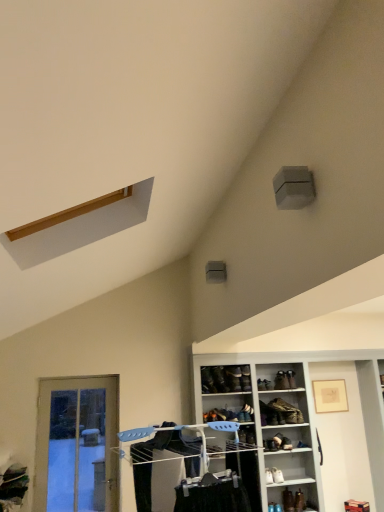
Question: Is leather shoe at lower right, which is counted as the eighth shoe, starting from the top, taller than leather shoe at center, the fifth shoe in the top-to-bottom sequence?

Choices:
 (A) no
 (B) yes

Answer: (B)

Question: From the image's perspective, is leather shoe at lower right, marked as the 2th shoe in a bottom-to-top arrangement, below leather shoe at center, the fifth shoe in the top-to-bottom sequence?

Choices:
 (A) no
 (B) yes

Answer: (B)

Question: Considering the relative sizes of leather shoe at lower right, which is counted as the eighth shoe, starting from the top, and leather shoe at center, the fifth shoe in the top-to-bottom sequence, in the image provided, is leather shoe at lower right, which is counted as the eighth shoe, starting from the top, shorter than leather shoe at center, the fifth shoe in the top-to-bottom sequence,?

Choices:
 (A) yes
 (B) no

Answer: (B)

Question: Does leather shoe at lower right, which is counted as the eighth shoe, starting from the top, come behind leather shoe at center, placed as the fifth shoe when sorted from bottom to top?

Choices:
 (A) yes
 (B) no

Answer: (B)

Question: Can you confirm if leather shoe at lower right, marked as the 2th shoe in a bottom-to-top arrangement, is wider than leather shoe at center, placed as the fifth shoe when sorted from bottom to top?

Choices:
 (A) no
 (B) yes

Answer: (B)

Question: Is leather shoe at lower right, marked as the 2th shoe in a bottom-to-top arrangement, not within leather shoe at center, placed as the fifth shoe when sorted from bottom to top?

Choices:
 (A) no
 (B) yes

Answer: (B)

Question: Considering the relative sizes of leather shoe at center, placed as the fifth shoe when sorted from bottom to top, and matte plastic clothes rack at center in the image provided, is leather shoe at center, placed as the fifth shoe when sorted from bottom to top, taller than matte plastic clothes rack at center?

Choices:
 (A) yes
 (B) no

Answer: (B)

Question: Is matte plastic clothes rack at center a part of leather shoe at center, placed as the fifth shoe when sorted from bottom to top?

Choices:
 (A) yes
 (B) no

Answer: (B)

Question: Can you confirm if leather shoe at center, the fifth shoe in the top-to-bottom sequence, is smaller than matte plastic clothes rack at center?

Choices:
 (A) yes
 (B) no

Answer: (A)

Question: From the image's perspective, would you say leather shoe at center, the fifth shoe in the top-to-bottom sequence, is shown under matte plastic clothes rack at center?

Choices:
 (A) no
 (B) yes

Answer: (B)

Question: From a real-world perspective, is leather shoe at center, the fifth shoe in the top-to-bottom sequence, physically above matte plastic clothes rack at center?

Choices:
 (A) yes
 (B) no

Answer: (A)

Question: From the image's perspective, is leather shoe at center, the fifth shoe in the top-to-bottom sequence, over matte plastic clothes rack at center?

Choices:
 (A) yes
 (B) no

Answer: (B)

Question: Considering the relative sizes of leather shoe at center, the fifth shoe in the top-to-bottom sequence, and translucent glass door at lower left in the image provided, is leather shoe at center, the fifth shoe in the top-to-bottom sequence, bigger than translucent glass door at lower left?

Choices:
 (A) no
 (B) yes

Answer: (A)